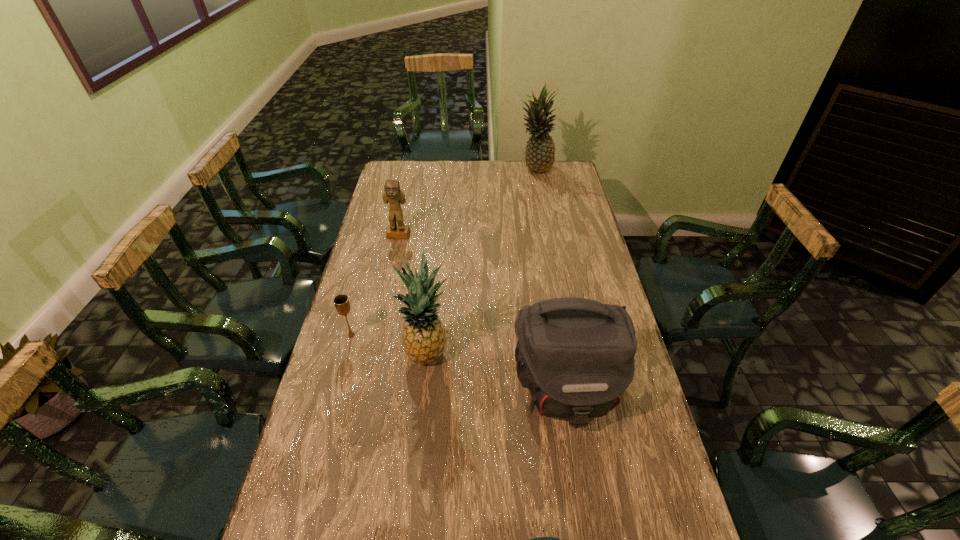
Where is `object that ranks as the second closest to the right pineapple`? The height and width of the screenshot is (540, 960). object that ranks as the second closest to the right pineapple is located at coordinates (424, 337).

Identify which object is located as the fifth nearest to the second shortest object. Please provide its 2D coordinates. Your answer should be formatted as a tuple, i.e. [(x, y)], where the tuple contains the x and y coordinates of a point satisfying the conditions above.

[(539, 156)]

The height and width of the screenshot is (540, 960). I want to click on free location that satisfies the following two spatial constraints: 1. on the front side of the left pineapple; 2. on the right side of the chalice, so click(x=347, y=353).

Where is `vacant space that satisfies the following two spatial constraints: 1. on the front side of the left pineapple; 2. on the right side of the chalice`? vacant space that satisfies the following two spatial constraints: 1. on the front side of the left pineapple; 2. on the right side of the chalice is located at coordinates (347, 353).